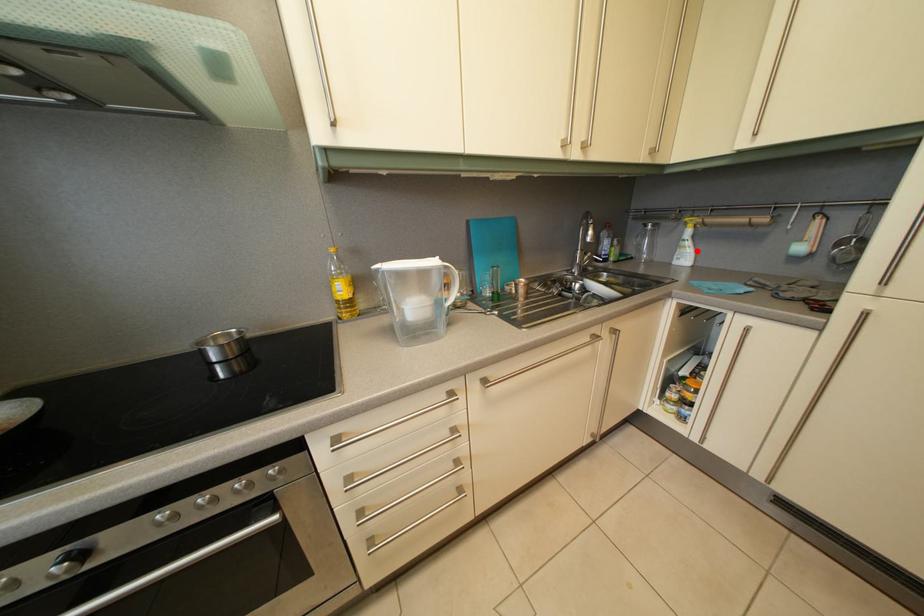
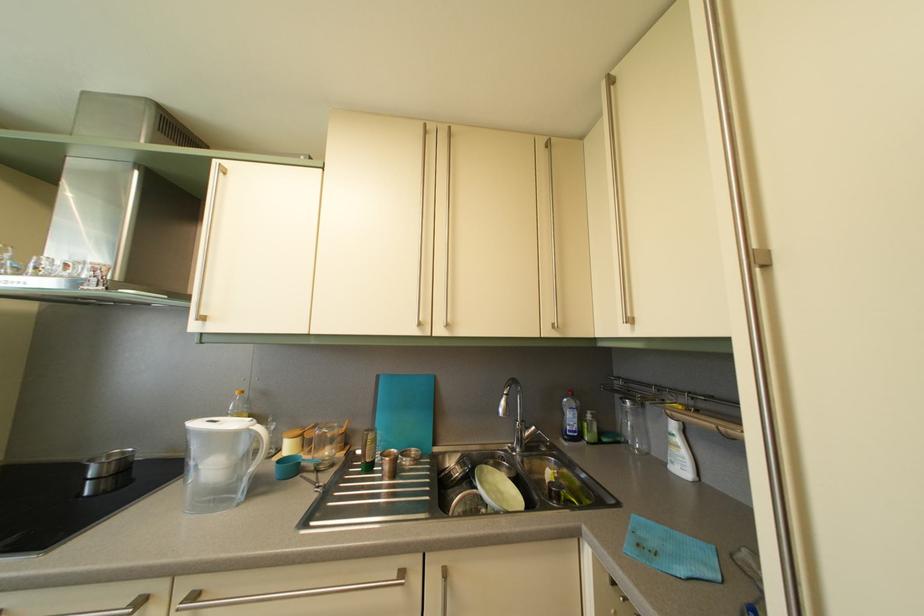
Find the pixel in the second image that matches the highlighted location in the first image.

(687, 448)